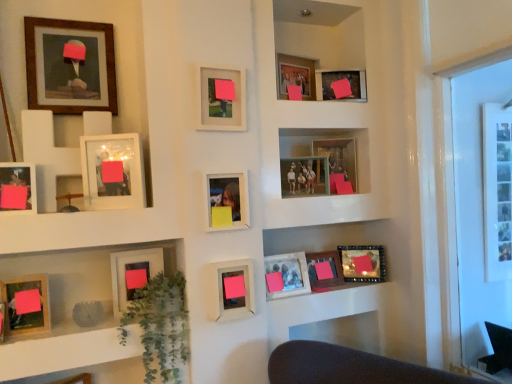
Question: Is matte wooden picture frame at lower center, the fourth picture frame from the right, bigger than matte glass picture frame at center, the ninth picture frame from the left?

Choices:
 (A) yes
 (B) no

Answer: (B)

Question: Is matte wooden picture frame at lower center, the fourth picture frame from the right, at the right side of matte glass picture frame at center, the ninth picture frame from the left?

Choices:
 (A) no
 (B) yes

Answer: (B)

Question: Is the depth of matte wooden picture frame at lower center, the fourth picture frame from the right, greater than that of matte glass picture frame at center, which appears as the seventh picture frame when viewed from the right?

Choices:
 (A) yes
 (B) no

Answer: (A)

Question: From a real-world perspective, is matte wooden picture frame at lower center, the fourth picture frame from the right, positioned under matte glass picture frame at center, which appears as the seventh picture frame when viewed from the right, based on gravity?

Choices:
 (A) yes
 (B) no

Answer: (A)

Question: Is matte wooden picture frame at lower center, acting as the twelfth picture frame starting from the left, positioned far away from matte glass picture frame at center, which appears as the seventh picture frame when viewed from the right?

Choices:
 (A) no
 (B) yes

Answer: (A)

Question: From the image's perspective, relative to wooden photo frame at upper center, which ranks as the second picture frame in right-to-left order, is matte wooden picture frame at lower left, which is the fifth picture frame from left to right, above or below?

Choices:
 (A) below
 (B) above

Answer: (A)

Question: From a real-world perspective, is matte wooden picture frame at lower left, which is counted as the eleventh picture frame, starting from the right, positioned above or below wooden photo frame at upper center, the fourteenth picture frame viewed from the left?

Choices:
 (A) below
 (B) above

Answer: (A)

Question: Considering the positions of point (134, 256) and point (353, 79), is point (134, 256) closer or farther from the camera than point (353, 79)?

Choices:
 (A) farther
 (B) closer

Answer: (B)

Question: In the image, is matte wooden picture frame at lower left, which is counted as the eleventh picture frame, starting from the right, on the left side or the right side of wooden photo frame at upper center, the fourteenth picture frame viewed from the left?

Choices:
 (A) left
 (B) right

Answer: (A)

Question: From a real-world perspective, is matte wooden picture frame at lower left, the 14th picture frame when ordered from right to left, physically located above or below wooden frame at upper left?

Choices:
 (A) below
 (B) above

Answer: (A)

Question: Is matte wooden picture frame at lower left, acting as the 2th picture frame starting from the left, wider or thinner than wooden frame at upper left?

Choices:
 (A) thin
 (B) wide

Answer: (A)

Question: Is matte wooden picture frame at lower left, acting as the 2th picture frame starting from the left, in front of or behind wooden frame at upper left in the image?

Choices:
 (A) front
 (B) behind

Answer: (B)

Question: Is matte wooden picture frame at lower left, the 14th picture frame when ordered from right to left, spatially inside wooden frame at upper left, or outside of it?

Choices:
 (A) inside
 (B) outside

Answer: (B)

Question: Is point (117, 307) positioned closer to the camera than point (89, 89)?

Choices:
 (A) closer
 (B) farther

Answer: (A)

Question: Is matte wooden picture frame at lower left, which is the fifth picture frame from left to right, in front of or behind wooden framed portrait at upper left, the 13th picture frame when ordered from right to left, in the image?

Choices:
 (A) behind
 (B) front

Answer: (A)